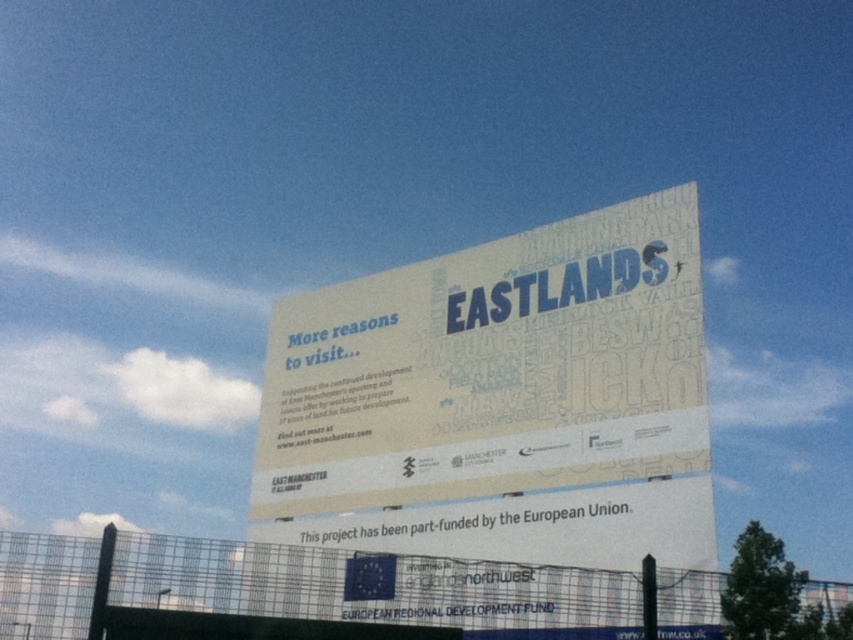
You are standing in front of the billboard and want to take a photo of both the white paper billboard at center and the metal mesh fence at lower center. Which object should you focus on first to ensure both are in frame without moving the camera?

You should focus on the metal mesh fence at lower center first because the white paper billboard at center occupies less space than it, so adjusting the camera to include the larger metal mesh fence at lower center will naturally include the smaller white paper billboard at center in the frame.

You are standing in front of the billboard and want to read the text at the bottom. Do you think the white paper billboard at center is tall enough for you to read the text without bending down, considering the metal mesh fence at lower center is blocking your view?

The white paper billboard at center has a lesser height compared to metal mesh fence at lower center, so the billboard is shorter than the fence. Since the fence is blocking your view, you might need to bend down to read the text at the bottom of the billboard.

You are a painter who wants to cover the white paper billboard at center and the metal mesh fence at lower center with a single large canvas. The canvas is 2 meters wide. Can you cover both objects with this canvas?

The white paper billboard at center is narrower than the metal mesh fence at lower center. Since the canvas is 2 meters wide, it can cover both objects if their combined width is less than or equal to 2 meters. However, without knowing the exact widths of each object, it is impossible to determine if the canvas will suffice.